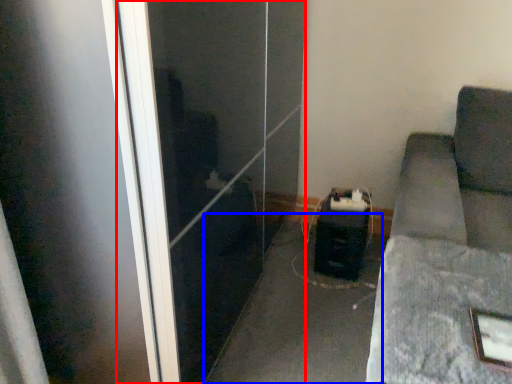
Question: Which object appears closest to the camera in this image, screen door (highlighted by a red box) or concrete (highlighted by a blue box)?

Choices:
 (A) screen door
 (B) concrete

Answer: (A)